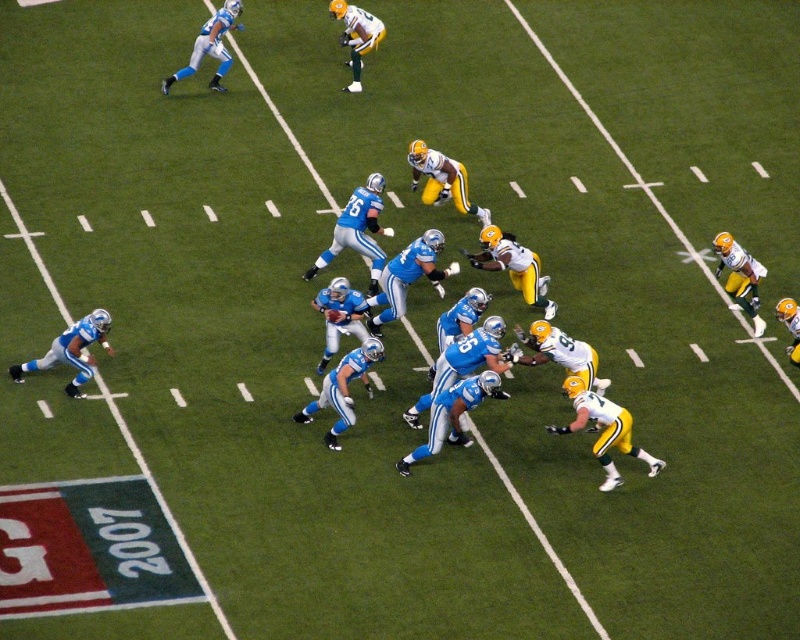
You are a sports analyst watching the game. You notice the green matte jersey at right and the light blue jersey at upper left. Which player is positioned more to the right side of the field?

The green matte jersey at right is positioned more to the right side of the field than the light blue jersey at upper left.

You are a sports analyst watching the game and want to describe the positions of the players wearing the green matte jersey at right and the light blue jersey at upper left. Which player is closer to the camera?

The green matte jersey at right is closer to the camera because it is in front of the light blue jersey at upper left.

You are a sports analyst watching the game. You notice two players wearing the green matte jersey at right and the light blue jersey at upper left. Which player appears to be closer to the camera based on their jersey sizes?

The green matte jersey at right appears smaller than the light blue jersey at upper left, which suggests that the player in the green matte jersey at right is farther from the camera and thus the light blue jersey at upper left is closer.